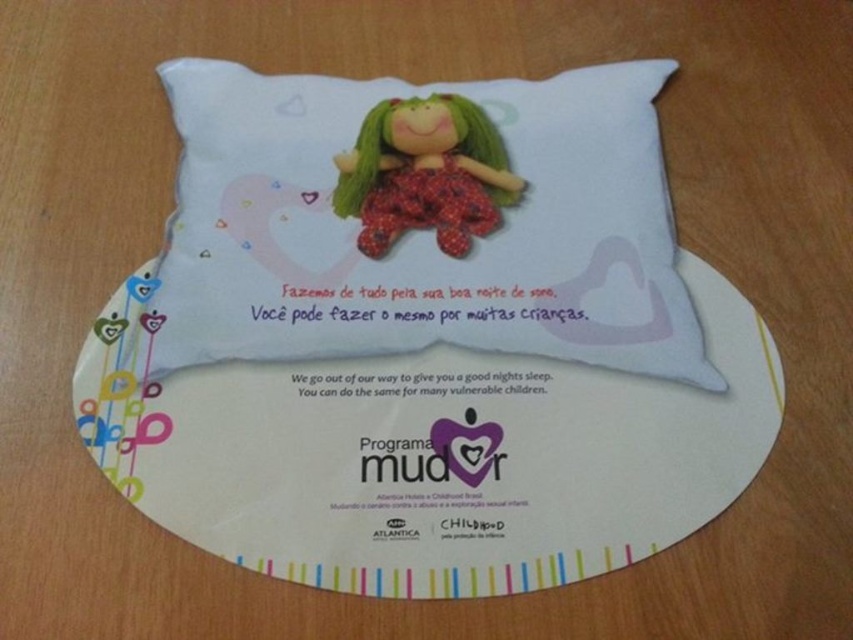
Question: Does white paper plate at center appear on the right side of matte plastic doll at center?

Choices:
 (A) yes
 (B) no

Answer: (A)

Question: Which object is farther from the camera taking this photo?

Choices:
 (A) matte plastic doll at center
 (B) white soft pillow at center

Answer: (A)

Question: Does white soft pillow at center have a greater width compared to matte plastic doll at center?

Choices:
 (A) no
 (B) yes

Answer: (B)

Question: Where is white soft pillow at center located in relation to white paper plate at center in the image?

Choices:
 (A) above
 (B) below

Answer: (A)

Question: Which object appears closest to the camera in this image?

Choices:
 (A) white soft pillow at center
 (B) matte plastic doll at center
 (C) white paper plate at center

Answer: (C)

Question: Estimate the real-world distances between objects in this image. Which object is closer to the white soft pillow at center?

Choices:
 (A) matte plastic doll at center
 (B) white paper plate at center

Answer: (A)